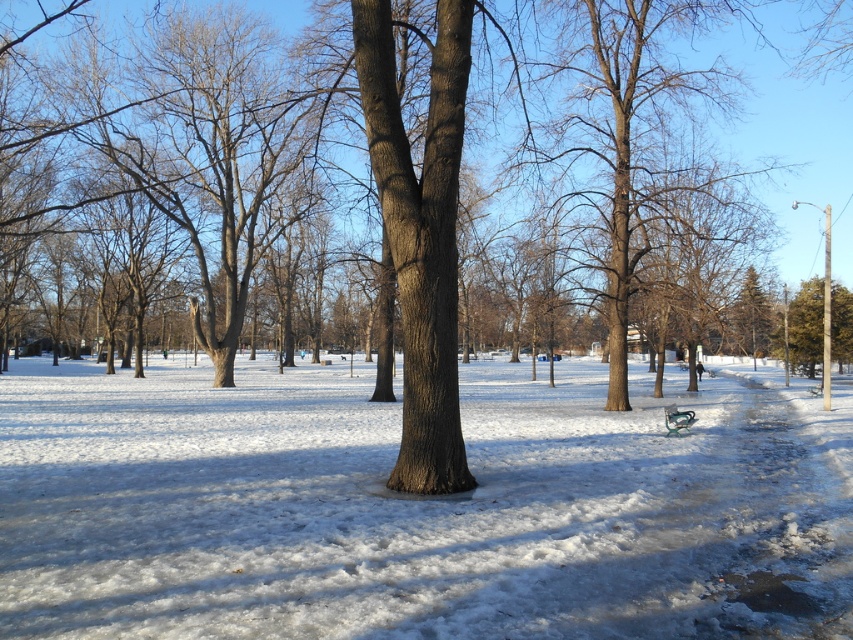
Is green textured evergreen tree at right thinner than green plastic bench at lower right?

In fact, green textured evergreen tree at right might be wider than green plastic bench at lower right.

This screenshot has width=853, height=640. Describe the element at coordinates (749, 317) in the screenshot. I see `green textured evergreen tree at right` at that location.

The height and width of the screenshot is (640, 853). Find the location of `green textured evergreen tree at right`. green textured evergreen tree at right is located at coordinates (749, 317).

Which is more to the right, brown bark tree at center or green plastic bench at lower right?

brown bark tree at center

Does brown bark tree at center appear over green plastic bench at lower right?

Yes.

Is point (613, 81) behind point (675, 429)?

Yes, it is behind point (675, 429).

This screenshot has height=640, width=853. What are the coordinates of `brown bark tree at center` in the screenshot? It's located at (630, 132).

Can you confirm if brown bark tree at center is bigger than green textured evergreen tree at right?

Correct, brown bark tree at center is larger in size than green textured evergreen tree at right.

Is brown bark tree at center wider than green textured evergreen tree at right?

Correct, the width of brown bark tree at center exceeds that of green textured evergreen tree at right.

Which is in front, point (595, 70) or point (738, 310)?

Point (595, 70) is more forward.

Locate an element on the screen. Image resolution: width=853 pixels, height=640 pixels. brown bark tree at center is located at coordinates (630, 132).